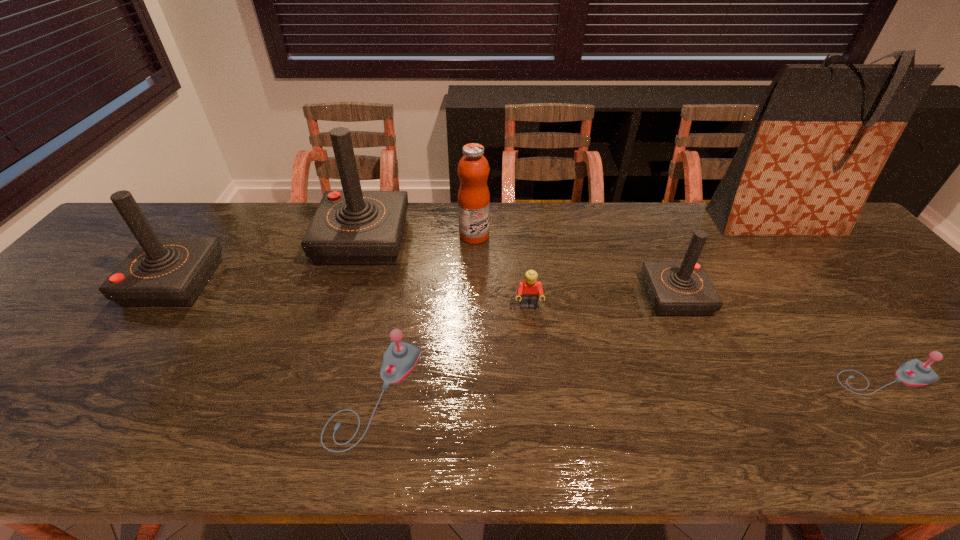
You are a GUI agent. You are given a task and a screenshot of the screen. Output one action in this format:
    pyautogui.click(x=<x>, y=<y>)
    Task: Click on the left gray joystick
    This screenshot has height=540, width=960.
    Given the screenshot: What is the action you would take?
    pyautogui.click(x=400, y=358)

Locate an element on the screen. the fourth tallest joystick is located at coordinates (400, 358).

Find the location of a particular element. The width and height of the screenshot is (960, 540). the shortest object is located at coordinates (914, 372).

Locate an element on the screen. This screenshot has width=960, height=540. the right gray joystick is located at coordinates (914, 372).

Locate an element on the screen. The height and width of the screenshot is (540, 960). free space located on the front-facing side of the tallest object is located at coordinates (814, 270).

Where is `vacant region located on the rectangular base of the seventh shortest object`? vacant region located on the rectangular base of the seventh shortest object is located at coordinates (342, 310).

This screenshot has width=960, height=540. In order to click on vacant space located 0.400m on the front label of the fourth object from left to right in this screenshot , I will do `click(621, 235)`.

Find the location of a particular element. Image resolution: width=960 pixels, height=540 pixels. vacant region located on the rectangular base of the second biggest red joystick is located at coordinates (260, 282).

Image resolution: width=960 pixels, height=540 pixels. Find the location of `vacant space located on the rectangular base of the third object from right to left`. vacant space located on the rectangular base of the third object from right to left is located at coordinates (531, 296).

Where is `vacant space located 0.170m on the rectangular base of the third object from right to left`? This screenshot has width=960, height=540. vacant space located 0.170m on the rectangular base of the third object from right to left is located at coordinates (581, 296).